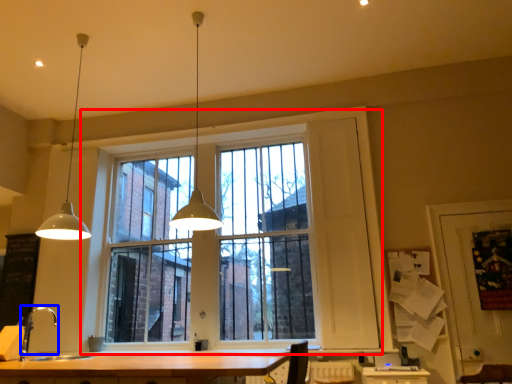
Question: Which object is further to the camera taking this photo, window (highlighted by a red box) or faucet (highlighted by a blue box)?

Choices:
 (A) window
 (B) faucet

Answer: (A)